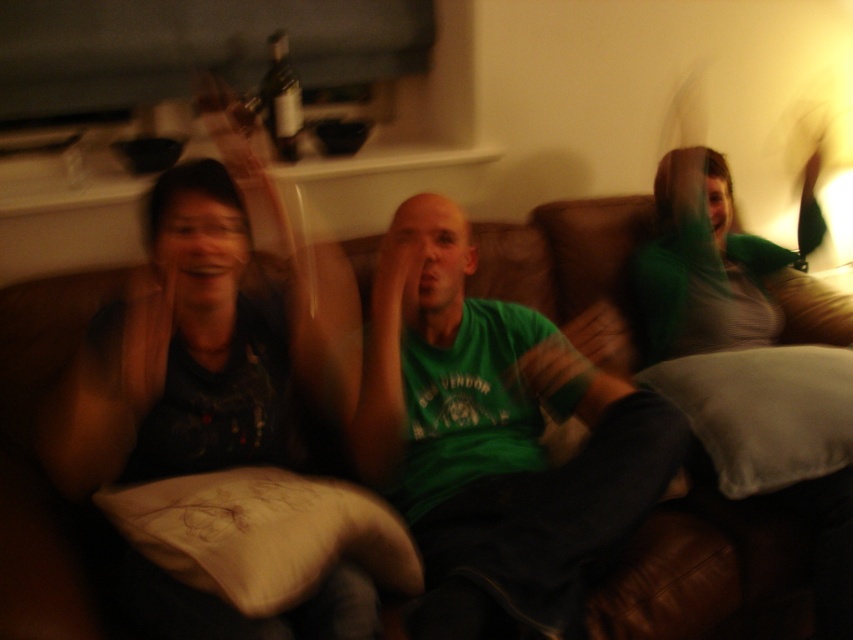
Question: Which point appears farthest from the camera in this image?

Choices:
 (A) (24, 595)
 (B) (772, 481)
 (C) (341, 493)

Answer: (B)

Question: From the image, what is the correct spatial relationship of green matte shirt at center in relation to brown leather couch at center?

Choices:
 (A) right
 (B) left

Answer: (A)

Question: Which point is farther to the camera?

Choices:
 (A) (582, 577)
 (B) (376, 540)

Answer: (B)

Question: In this image, where is green matte shirt at center located relative to green fabric pillow at right?

Choices:
 (A) left
 (B) right

Answer: (A)

Question: Which object appears farthest from the camera in this image?

Choices:
 (A) green fabric pillow at right
 (B) brown leather couch at center
 (C) white soft pillow at lower left
 (D) green matte shirt at center

Answer: (A)

Question: Observing the image, what is the correct spatial positioning of green matte shirt at center in reference to green fabric pillow at right?

Choices:
 (A) above
 (B) below

Answer: (B)